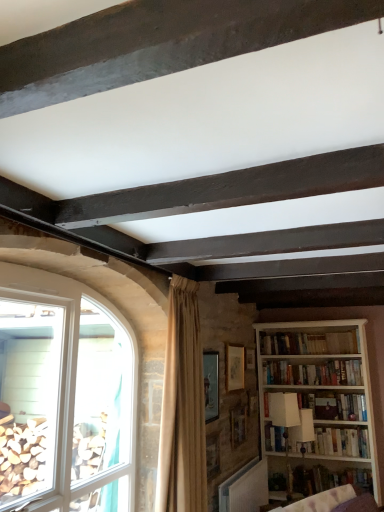
Question: Does clear glass window at lower left have a larger size compared to wooden picture frame at center, the third picture frame in the front-to-back sequence?

Choices:
 (A) no
 (B) yes

Answer: (B)

Question: Is clear glass window at lower left outside wooden picture frame at center, arranged as the 2th picture frame when viewed from the back?

Choices:
 (A) yes
 (B) no

Answer: (A)

Question: Is clear glass window at lower left closer to camera compared to wooden picture frame at center, the third picture frame in the front-to-back sequence?

Choices:
 (A) yes
 (B) no

Answer: (A)

Question: Does clear glass window at lower left turn towards wooden picture frame at center, arranged as the 2th picture frame when viewed from the back?

Choices:
 (A) no
 (B) yes

Answer: (A)

Question: Does clear glass window at lower left have a greater width compared to wooden picture frame at center, arranged as the 2th picture frame when viewed from the back?

Choices:
 (A) yes
 (B) no

Answer: (A)

Question: From the image's perspective, relative to wooden picture frame at center, the third picture frame in the front-to-back sequence, is white wooden bookshelf at center, which is counted as the third book, starting from the bottom, above or below?

Choices:
 (A) above
 (B) below

Answer: (A)

Question: Considering the positions of point (284, 373) and point (233, 419), is point (284, 373) closer or farther from the camera than point (233, 419)?

Choices:
 (A) closer
 (B) farther

Answer: (B)

Question: From their relative heights in the image, would you say white wooden bookshelf at center, which is counted as the third book, starting from the bottom, is taller or shorter than wooden picture frame at center, the third picture frame in the front-to-back sequence?

Choices:
 (A) tall
 (B) short

Answer: (B)

Question: From a real-world perspective, relative to wooden picture frame at center, arranged as the 2th picture frame when viewed from the back, is white wooden bookshelf at center, which is counted as the third book, starting from the bottom, vertically above or below?

Choices:
 (A) below
 (B) above

Answer: (B)

Question: Looking at their shapes, would you say beige fabric curtain at center is wider or thinner than white wooden bookcase at right?

Choices:
 (A) wide
 (B) thin

Answer: (B)

Question: From a real-world perspective, is beige fabric curtain at center physically located above or below white wooden bookcase at right?

Choices:
 (A) above
 (B) below

Answer: (A)

Question: Does point (195, 416) appear closer or farther from the camera than point (304, 457)?

Choices:
 (A) farther
 (B) closer

Answer: (B)

Question: Is beige fabric curtain at center taller or shorter than white wooden bookcase at right?

Choices:
 (A) tall
 (B) short

Answer: (B)

Question: From the image's perspective, is wooden picture frame at center, the second picture frame from the front, located above or below white wooden bookshelf at center, which is counted as the third book, starting from the bottom?

Choices:
 (A) below
 (B) above

Answer: (B)

Question: Considering the positions of wooden picture frame at center, the second picture frame from the front, and white wooden bookshelf at center, which is the 2th book in top-to-bottom order, in the image, is wooden picture frame at center, the second picture frame from the front, bigger or smaller than white wooden bookshelf at center, which is the 2th book in top-to-bottom order,?

Choices:
 (A) small
 (B) big

Answer: (A)